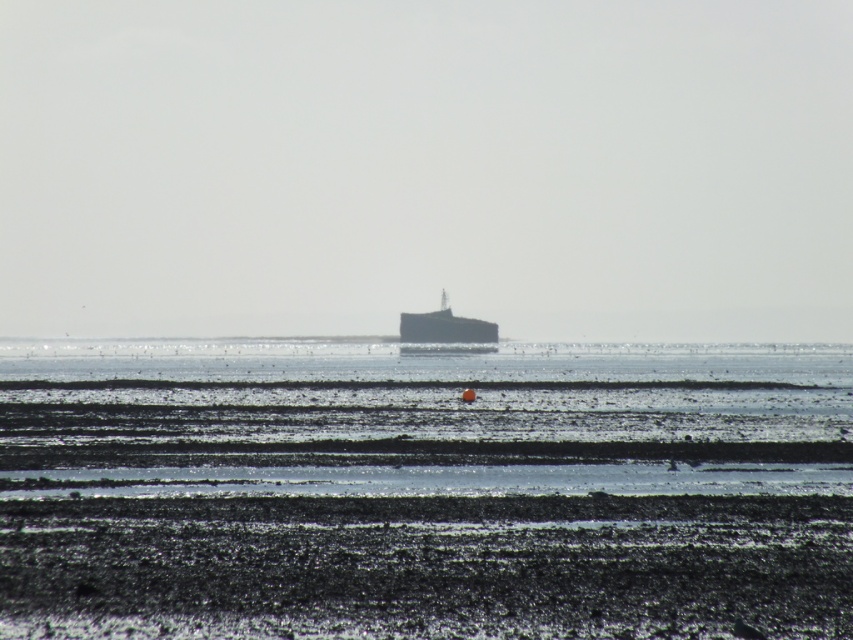
Question: From the image, what is the correct spatial relationship of black matte mud at lower center in relation to dark gray metallic boat at center?

Choices:
 (A) below
 (B) above

Answer: (A)

Question: Which of the following is the closest to the observer?

Choices:
 (A) (461, 324)
 (B) (263, 346)

Answer: (A)

Question: Is black matte mud at lower center smaller than dark gray metallic boat at center?

Choices:
 (A) yes
 (B) no

Answer: (A)

Question: Which is farther from the dark gray metallic boat at center?

Choices:
 (A) clear water at center
 (B) black matte mud at lower center

Answer: (B)

Question: Which object is the closest to the dark gray metallic boat at center?

Choices:
 (A) clear water at center
 (B) black matte mud at lower center

Answer: (A)

Question: Can you confirm if black matte mud at lower center is smaller than clear water at center?

Choices:
 (A) no
 (B) yes

Answer: (B)